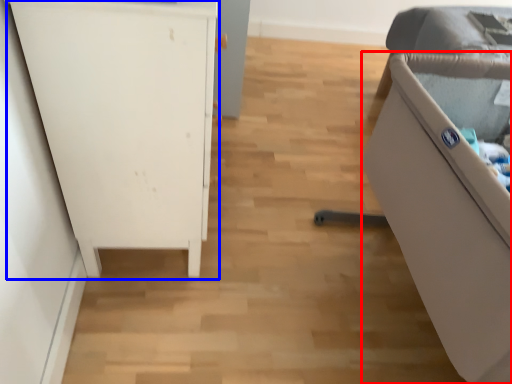
Question: Which point is further to the camera, furniture (highlighted by a red box) or furniture (highlighted by a blue box)?

Choices:
 (A) furniture
 (B) furniture

Answer: (B)